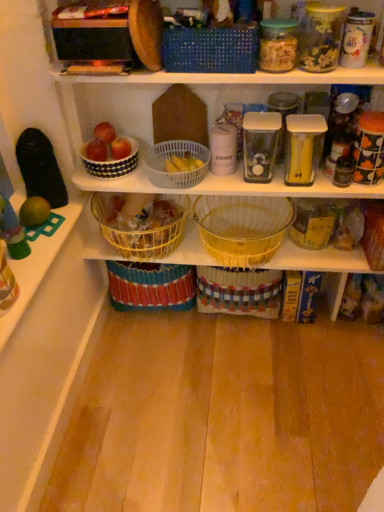
This screenshot has width=384, height=512. Find the location of `vacant region below white dotted bowl at upper left (from a real-world perspective)`. vacant region below white dotted bowl at upper left (from a real-world perspective) is located at coordinates (124, 170).